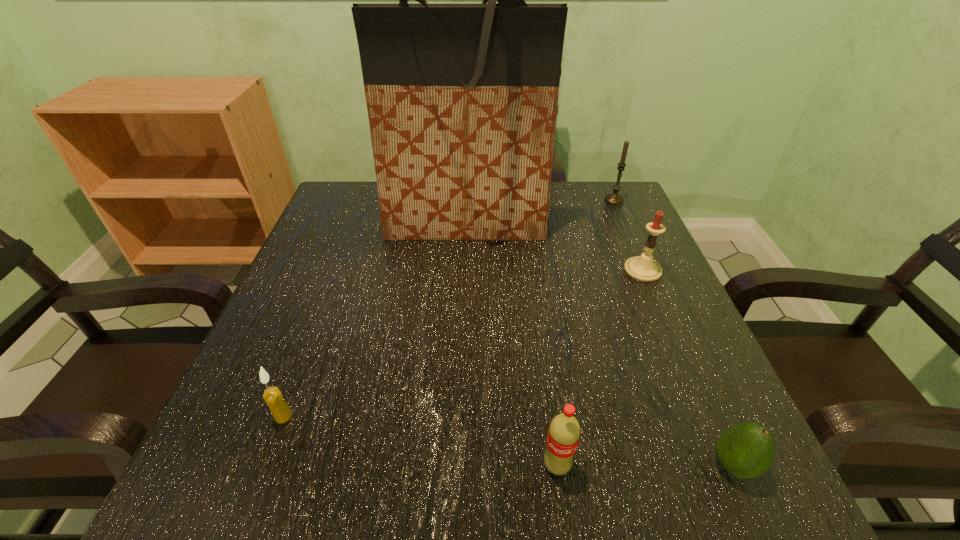
This screenshot has height=540, width=960. I want to click on vacant region that satisfies the following two spatial constraints: 1. on the back side of the soda; 2. on the right side of the second farthest candle, so click(531, 270).

Identify the location of free point that satisfies the following two spatial constraints: 1. on the back side of the fourth nearest object; 2. on the right side of the farthest candle. (612, 199).

Where is `vacant area that satisfies the following two spatial constraints: 1. on the front-facing side of the second nearest candle; 2. on the right side of the tallest object`? The image size is (960, 540). vacant area that satisfies the following two spatial constraints: 1. on the front-facing side of the second nearest candle; 2. on the right side of the tallest object is located at coordinates (464, 270).